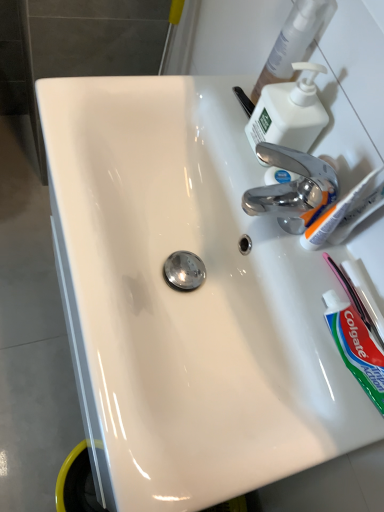
I want to click on blank area to the left of white plastic soap dispenser at upper right, so click(x=204, y=106).